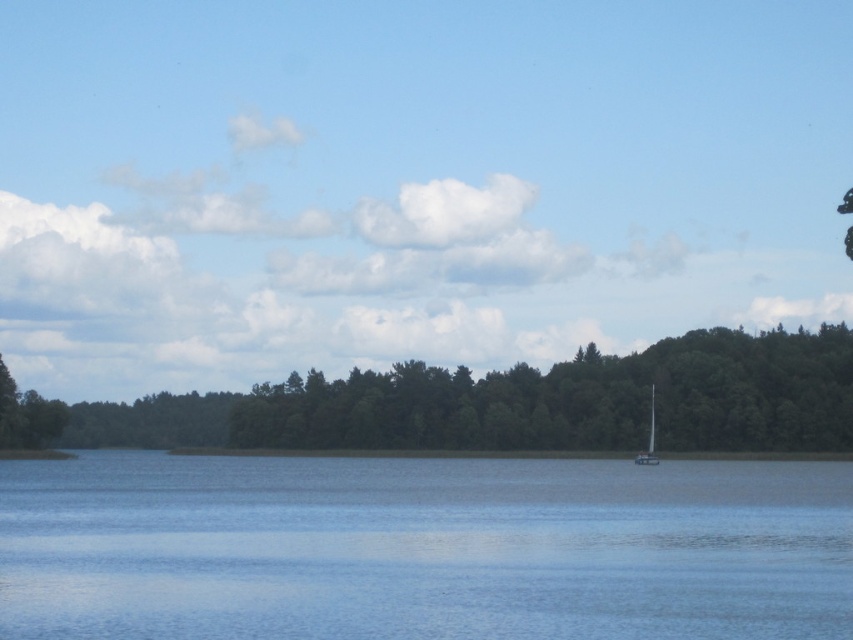
You are standing at the lakeside and see the transparent blue water at center and the green leafy trees at center. Which object is positioned to the right side of the other?

The transparent blue water at center is to the right of the green leafy trees at center.